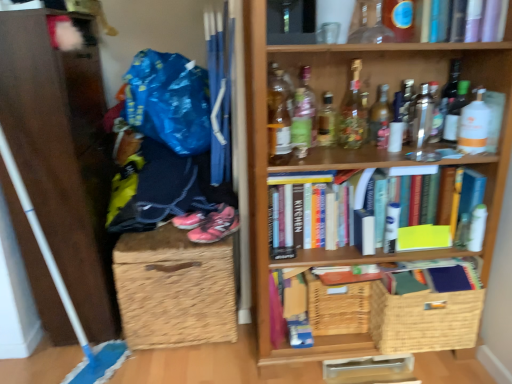
Question: Considering the positions of translucent glass bottle at upper center, placed as the eighth bottle when sorted from left to right, and woven brown basket at lower right, the second basket when ordered from left to right, in the image, is translucent glass bottle at upper center, placed as the eighth bottle when sorted from left to right, bigger or smaller than woven brown basket at lower right, the second basket when ordered from left to right,?

Choices:
 (A) big
 (B) small

Answer: (B)

Question: From a real-world perspective, is translucent glass bottle at upper center, placed as the eighth bottle when sorted from left to right, above or below woven brown basket at lower right, the first basket from the right?

Choices:
 (A) below
 (B) above

Answer: (B)

Question: Estimate the real-world distances between objects in this image. Which object is closer to the clear glass bottle at upper center, placed as the 3th bottle when sorted from right to left?

Choices:
 (A) cardboard box at center, the first book ordered from the bottom
 (B) translucent glass bottle at upper center, positioned as the sixth bottle in left-to-right order
 (C) hardcover books at center, the 3th book positioned from the bottom
 (D) translucent plastic bottle at upper right, positioned as the 1th bottle in right-to-left order
 (E) dark blue fabric pants at lower left

Answer: (B)

Question: Which object is positioned closest to the clear glass bottle at upper center, placed as the 3th bottle when sorted from right to left?

Choices:
 (A) translucent glass bottle at upper center, positioned as the sixth bottle in left-to-right order
 (B) woven brown basket at lower right, the first basket from the right
 (C) woven straw basket at lower center
 (D) clear glass bottle at upper right, positioned as the second bottle in right-to-left order
 (E) translucent glass bottle at upper center, marked as the eleventh bottle in a right-to-left arrangement

Answer: (D)